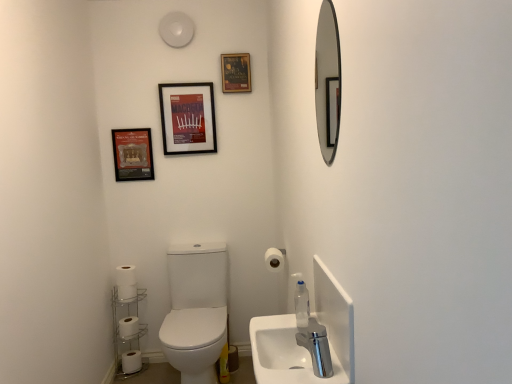
Question: Considering the relative positions of white ceramic sink at lower right and clear plastic soap dispenser at lower right in the image provided, is white ceramic sink at lower right to the left or to the right of clear plastic soap dispenser at lower right?

Choices:
 (A) right
 (B) left

Answer: (B)

Question: From their relative heights in the image, would you say white ceramic sink at lower right is taller or shorter than clear plastic soap dispenser at lower right?

Choices:
 (A) tall
 (B) short

Answer: (B)

Question: Estimate the real-world distances between objects in this image. Which object is closer to the matte black frame at upper left, which is counted as the 1th decorative picture, starting from the bottom?

Choices:
 (A) chrome metallic faucet at lower center
 (B) white matte toilet paper at lower left, which is the third toilet paper in front-to-back order
 (C) white matte toilet paper at lower right, which is the 1th toilet paper from top to bottom
 (D) white matte toilet paper at lower left, arranged as the second toilet paper when viewed from the top
 (E) white matte toilet paper at lower left, the first toilet paper positioned from the back

Answer: (D)

Question: Which of these objects is positioned farthest from the white matte toilet paper at lower right, which appears as the first toilet paper when viewed from the right?

Choices:
 (A) chrome metallic faucet at lower center
 (B) clear plastic soap dispenser at lower right
 (C) silver-framed mirror at upper right
 (D) matte black frame at upper left, arranged as the 1th decorative picture when viewed from the left
 (E) matte paper poster at upper center, the 2th decorative picture when ordered from left to right

Answer: (E)